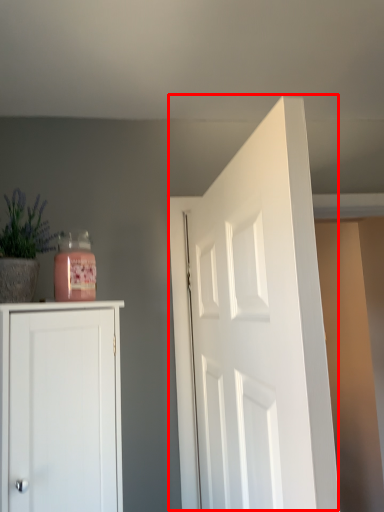
Question: Where is door (annotated by the red box) located in relation to plant in the image?

Choices:
 (A) right
 (B) left

Answer: (A)